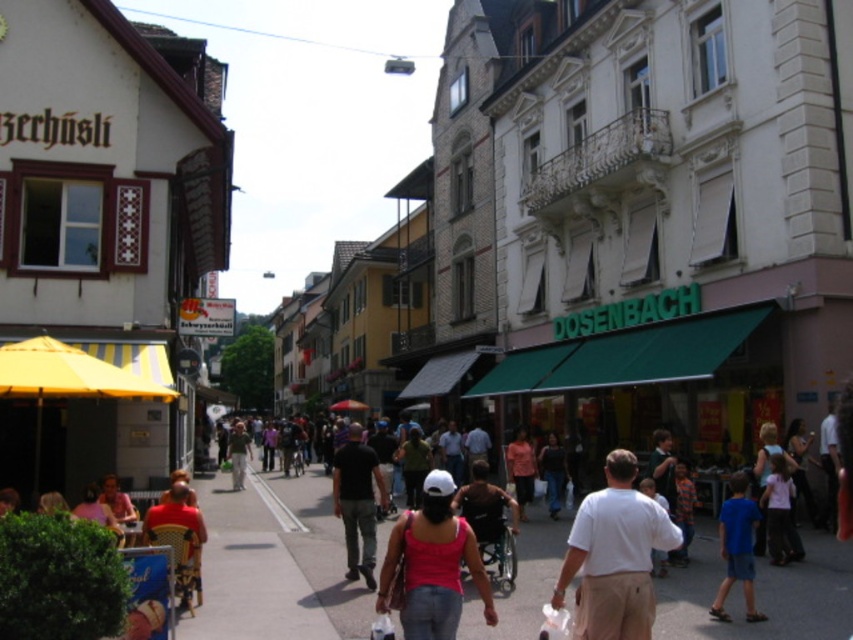
This screenshot has height=640, width=853. What do you see at coordinates (759, 593) in the screenshot?
I see `smooth asphalt sidewalk at center` at bounding box center [759, 593].

I want to click on smooth asphalt sidewalk at center, so click(759, 593).

Does white cotton shirt at center have a lesser width compared to pink fabric tank top at center?

No.

Describe the element at coordinates (614, 556) in the screenshot. I see `white cotton shirt at center` at that location.

Locate an element on the screen. This screenshot has width=853, height=640. white cotton shirt at center is located at coordinates (614, 556).

The width and height of the screenshot is (853, 640). Identify the location of white cotton shirt at center. (614, 556).

Is white cotton shirt at center smaller than black cotton shirt at center?

No.

Locate an element on the screen. The height and width of the screenshot is (640, 853). white cotton shirt at center is located at coordinates (614, 556).